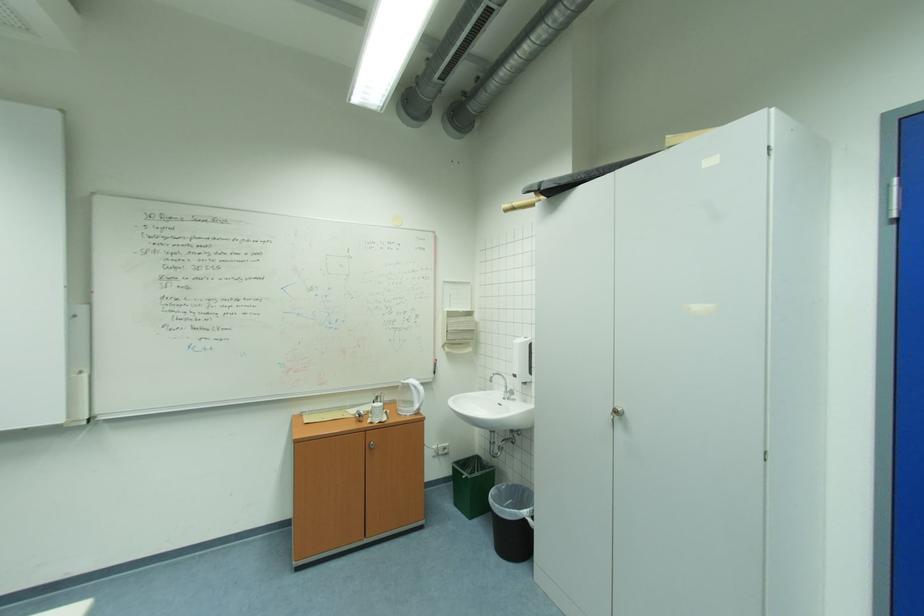
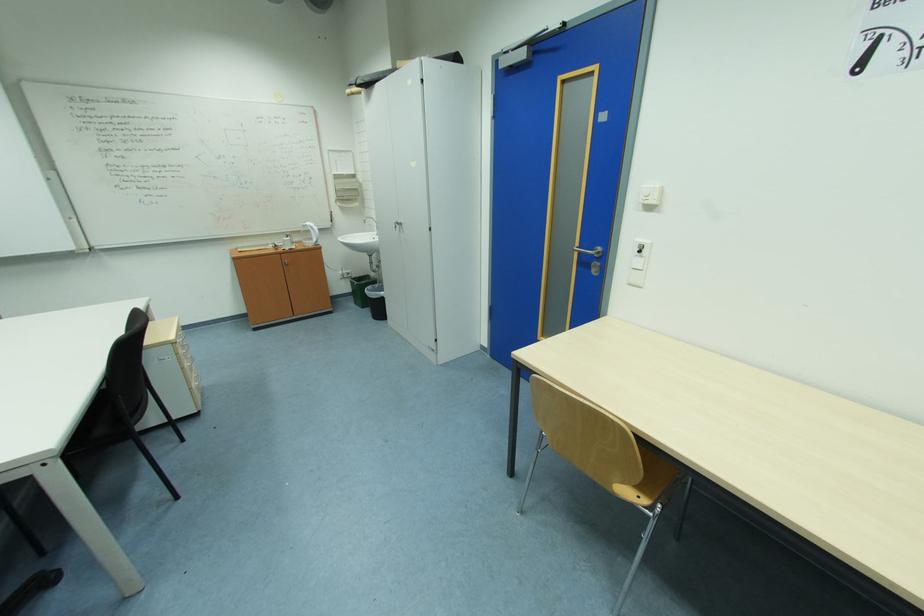
Locate, in the second image, the point that corresponds to the point at 499,379 in the first image.

(371, 222)